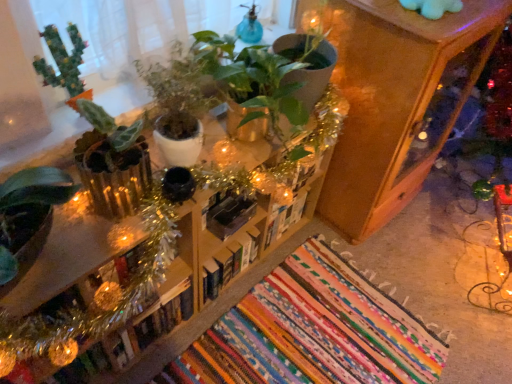
Find the location of a particular element. The width and height of the screenshot is (512, 384). vacant space in front of hardcover book at center, the first book in the left-to-right sequence is located at coordinates (156, 363).